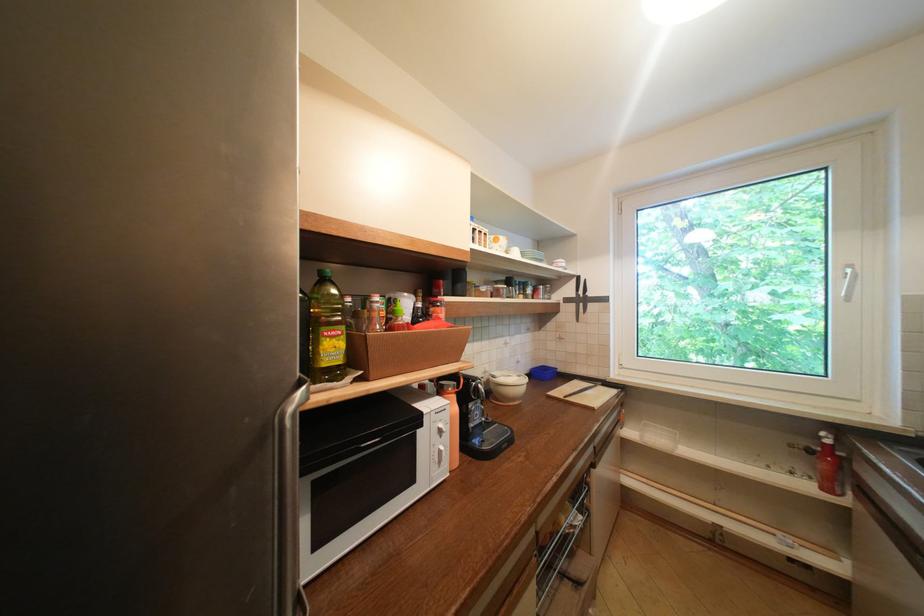
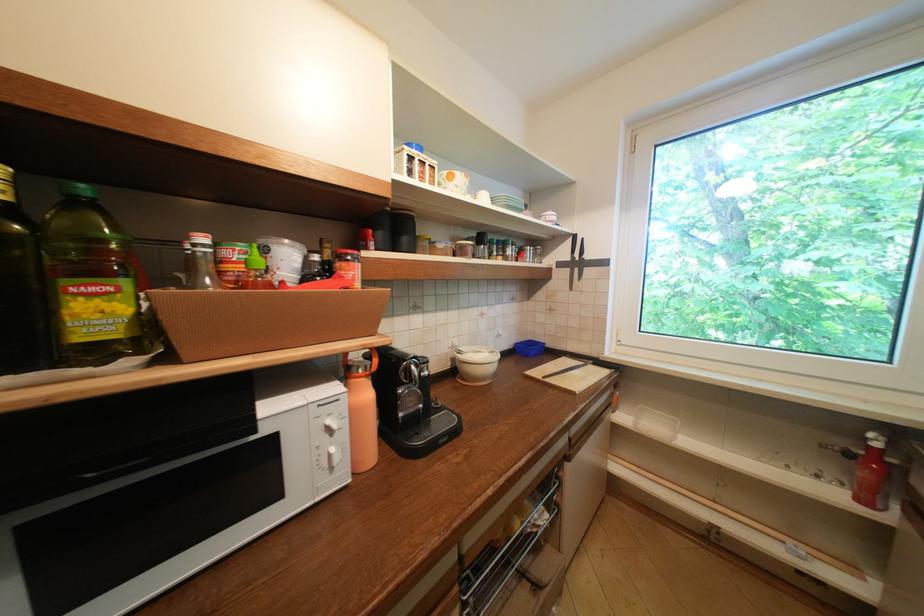
Question: Based on the continuous images, in which direction is the camera rotating? Reply with the corresponding letter.

Choices:
 (A) Left
 (B) Right
 (C) Up
 (D) Down

Answer: (D)